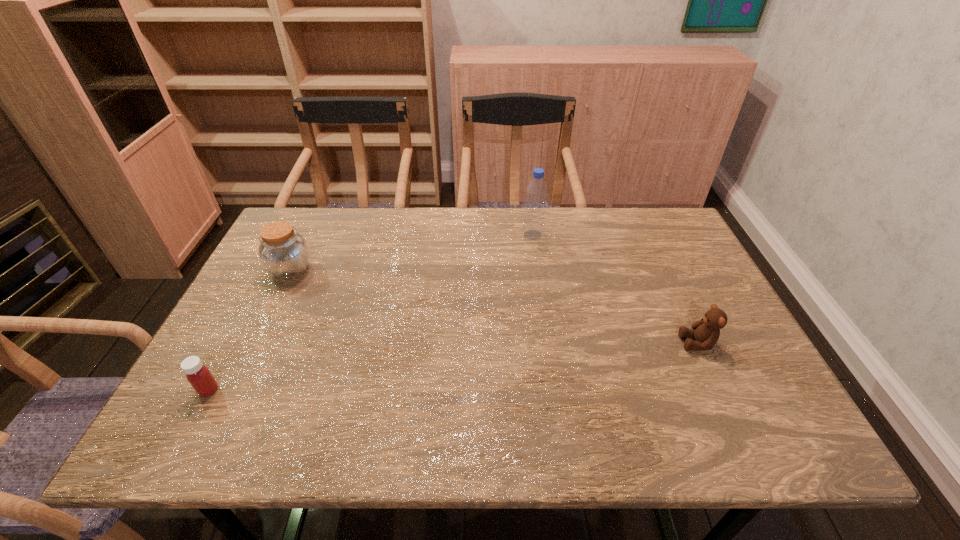
You are a GUI agent. You are given a task and a screenshot of the screen. Output one action in this format:
    pyautogui.click(x=<x>, y=<y>)
    Task: Click on the vacant space located on the face of the second nearest object
    
    Given the screenshot: What is the action you would take?
    pyautogui.click(x=525, y=343)

Locate an element on the screen. This screenshot has width=960, height=540. blank space located 0.290m on the face of the second nearest object is located at coordinates [559, 343].

The image size is (960, 540). Identify the location of free space located 0.390m on the right of the medicine. (398, 390).

Locate an element on the screen. object located at the far edge is located at coordinates (533, 226).

Locate an element on the screen. jar that is at the left edge is located at coordinates (284, 253).

Find the location of a particular element. The image size is (960, 540). medicine at the left edge is located at coordinates (198, 375).

Where is `object that is at the right edge`? The image size is (960, 540). object that is at the right edge is located at coordinates (706, 332).

Identify the location of free space at the far edge of the desktop. This screenshot has width=960, height=540. (481, 253).

You are a GUI agent. You are given a task and a screenshot of the screen. Output one action in this format:
    pyautogui.click(x=<x>, y=<y>)
    Task: Click on the free space at the near edge of the desktop
    The height and width of the screenshot is (540, 960).
    Given the screenshot: What is the action you would take?
    pyautogui.click(x=694, y=431)

Identify the location of vacant region at the left edge. (261, 339).